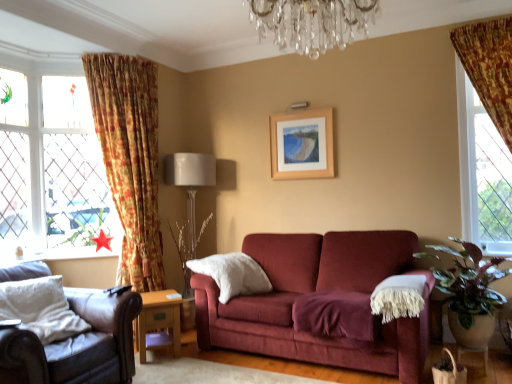
This screenshot has width=512, height=384. I want to click on free space above wooden picture frame at upper center (from a real-world perspective), so [x=300, y=103].